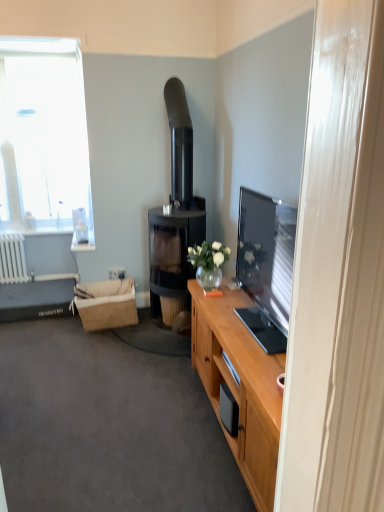
The height and width of the screenshot is (512, 384). What are the coordinates of `vacant area on top of wooden cabinet at lower right (from a real-world perspective)` in the screenshot? It's located at (100, 396).